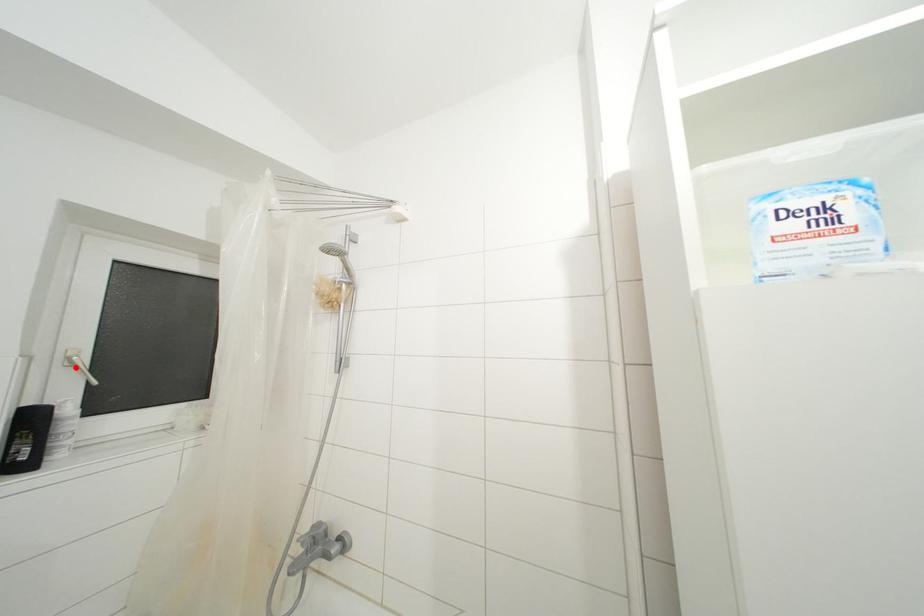
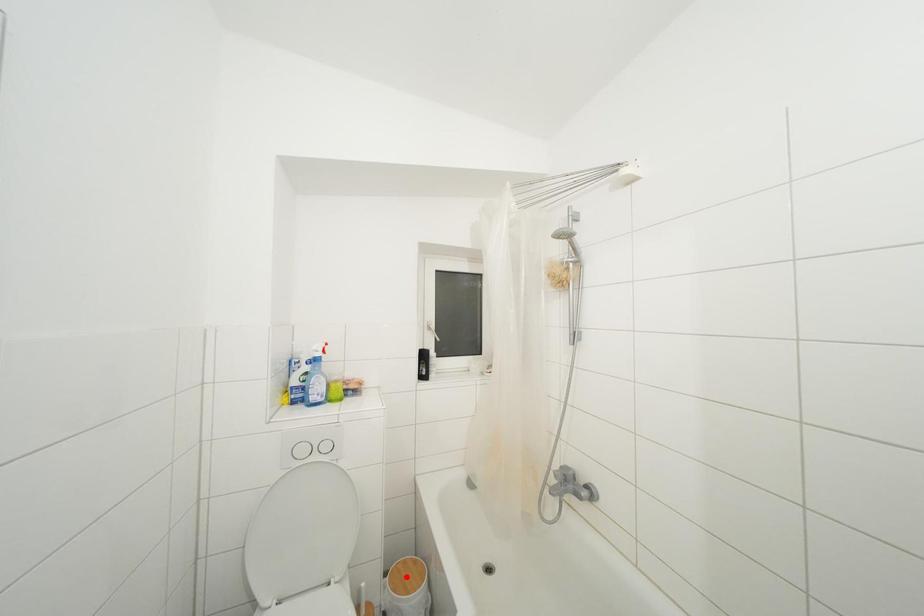
In the scene shown: I am providing you with two images of the same scene from different viewpoints. A red point is marked on the first image and another point is marked on the second image. Are the points marked in image1 and image2 representing the same 3D position?

No